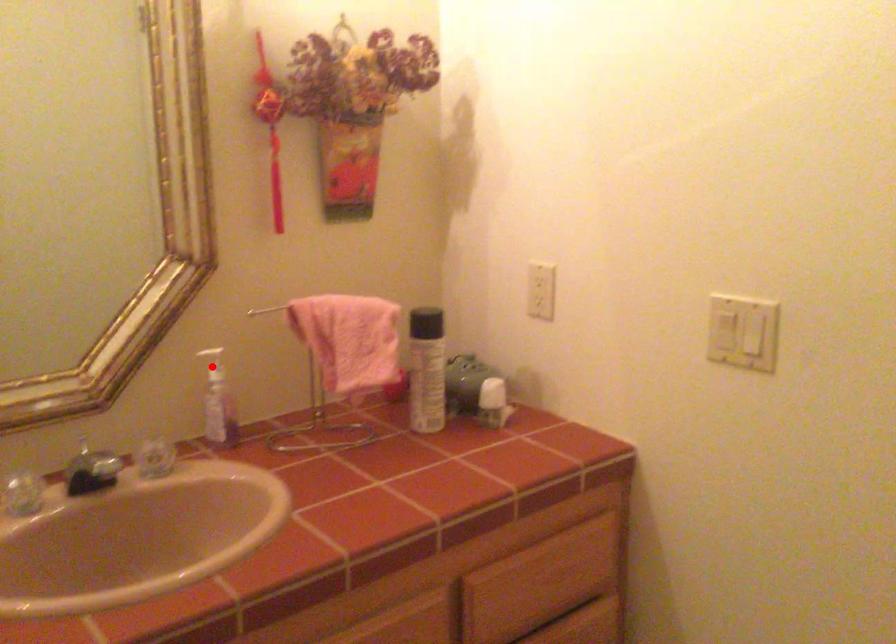
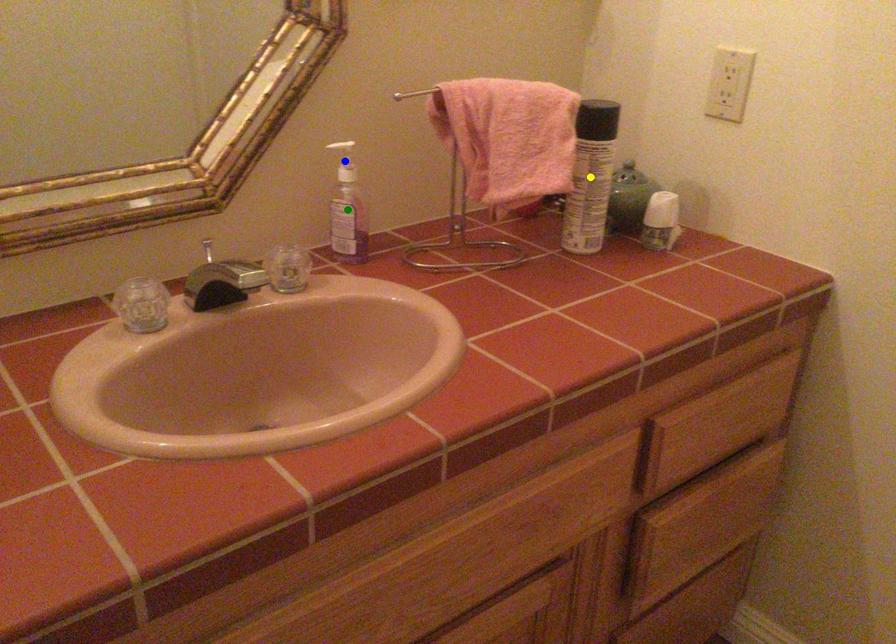
Question: I am providing you with two images of the same scene from different viewpoints. A red point is marked on the first image. You are given multiple points on the second image. Which point in image 2 represents the same 3d spot as the red point in image 1?

Choices:
 (A) blue point
 (B) yellow point
 (C) green point

Answer: (A)